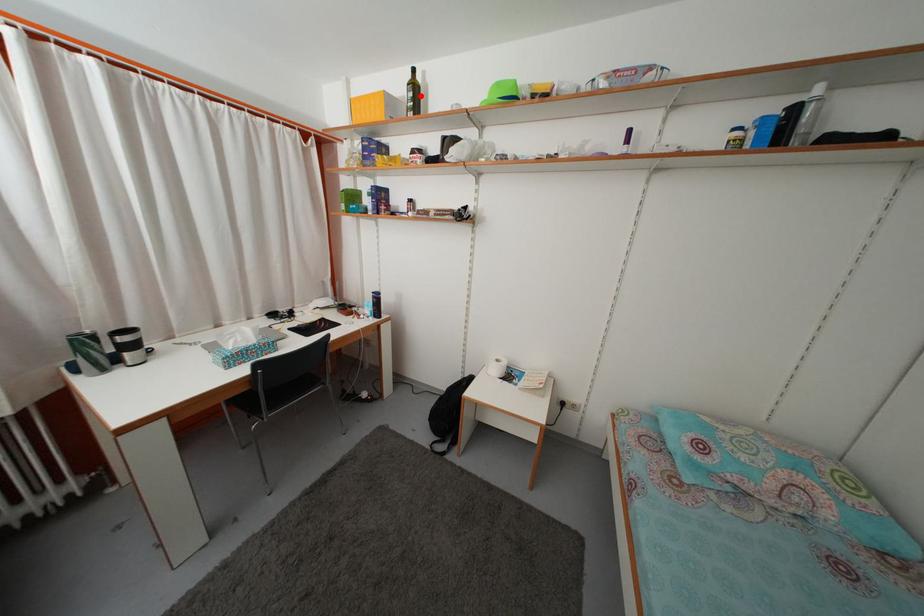
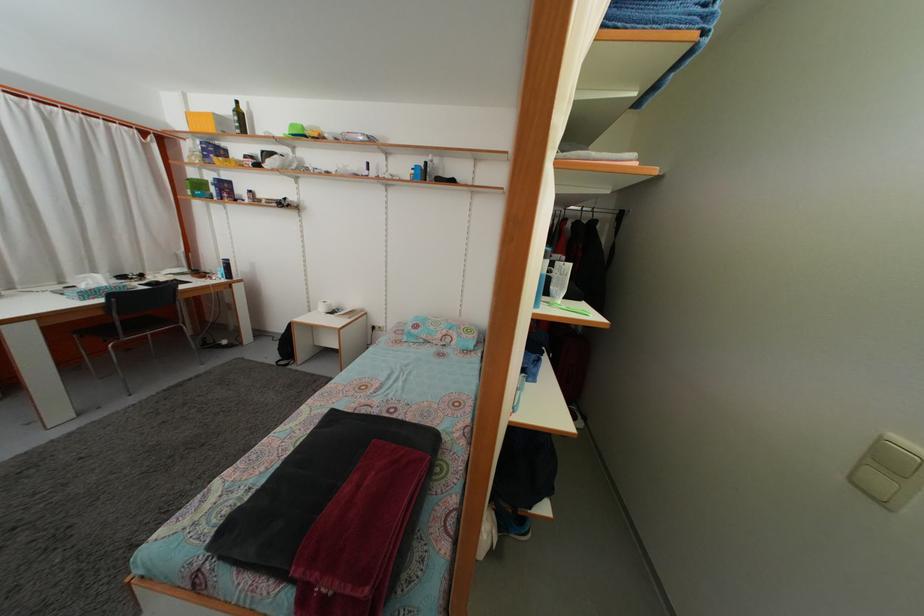
Where in the second image is the point corresponding to the highlighted location from the first image?

(246, 122)